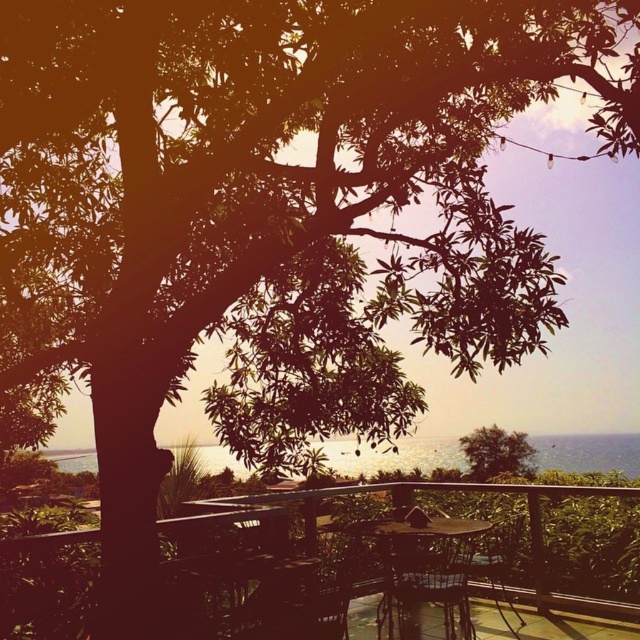
You are sitting on the wooden chair at center and want to enjoy the view of the green leafy tree at center. Which direction should you turn your head to look at the tree?

The green leafy tree at center is positioned on the right side of the wooden chair at center, so you should turn your head to the right to look at the tree.

You are planning to place a new potted plant on the wooden table at center or the wooden chair at center. Based on their sizes, which surface is more suitable for the plant?

The wooden table at center is smaller than the wooden chair at center, so the wooden chair at center would be more suitable for placing the potted plant as it provides a larger surface area.